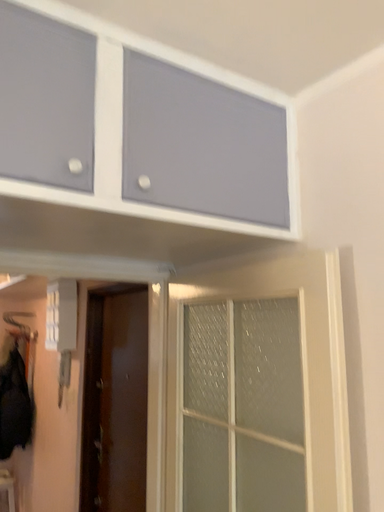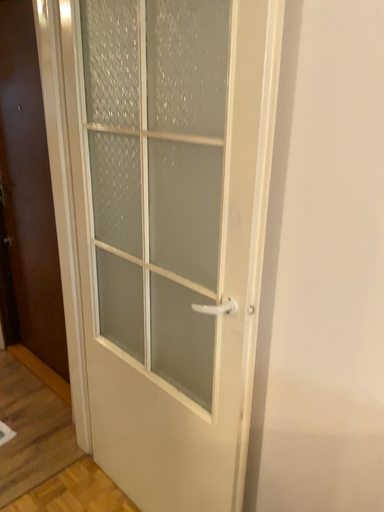
Question: How did the camera likely rotate when shooting the video?

Choices:
 (A) rotated downward
 (B) rotated upward

Answer: (A)